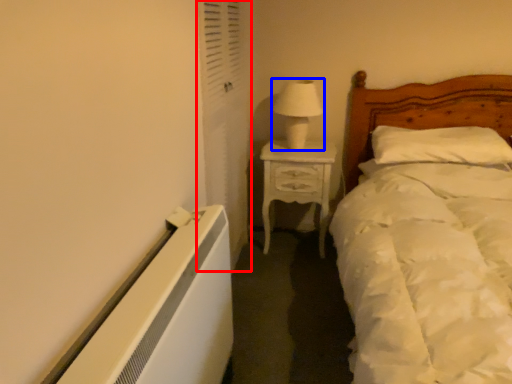
Question: Which object is closer to the camera taking this photo, screen door (highlighted by a red box) or table lamp (highlighted by a blue box)?

Choices:
 (A) screen door
 (B) table lamp

Answer: (A)